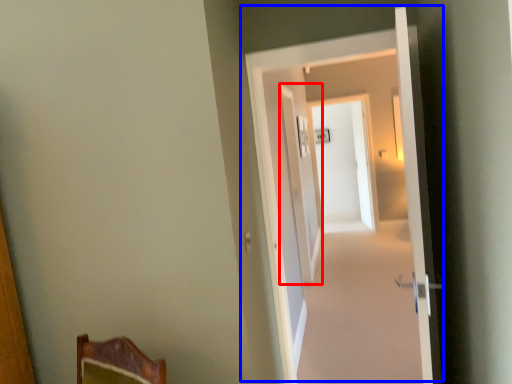
Question: Which object appears farthest to the camera in this image, screen door (highlighted by a red box) or door (highlighted by a blue box)?

Choices:
 (A) screen door
 (B) door

Answer: (A)